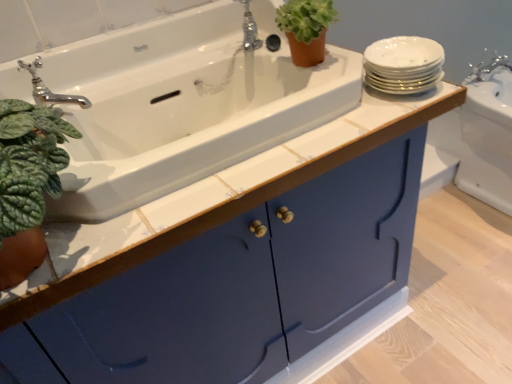
Question: Can you confirm if white glossy sink at upper right, the 2th sink from the front, is smaller than white porcelain plates at upper right?

Choices:
 (A) no
 (B) yes

Answer: (A)

Question: Would you consider white glossy sink at upper right, the first sink from the back, to be distant from white porcelain plates at upper right?

Choices:
 (A) yes
 (B) no

Answer: (B)

Question: Considering the relative positions of white glossy sink at upper right, which is the second sink from left to right, and white porcelain plates at upper right in the image provided, is white glossy sink at upper right, which is the second sink from left to right, to the left of white porcelain plates at upper right from the viewer's perspective?

Choices:
 (A) yes
 (B) no

Answer: (B)

Question: Is white glossy sink at upper right, the first sink from the back, positioned before white porcelain plates at upper right?

Choices:
 (A) yes
 (B) no

Answer: (B)

Question: Can we say white glossy sink at upper right, the 2th sink from the front, lies outside white porcelain plates at upper right?

Choices:
 (A) yes
 (B) no

Answer: (A)

Question: From the image's perspective, is white ceramic sink at upper left, the 2th sink from the back, above or below matte blue cabinet at center?

Choices:
 (A) below
 (B) above

Answer: (B)

Question: Is white ceramic sink at upper left, the 2th sink when ordered from right to left, in front of or behind matte blue cabinet at center in the image?

Choices:
 (A) behind
 (B) front

Answer: (A)

Question: Is white ceramic sink at upper left, which is the first sink from front to back, bigger or smaller than matte blue cabinet at center?

Choices:
 (A) big
 (B) small

Answer: (B)

Question: Considering the positions of white ceramic sink at upper left, which ranks as the first sink in left-to-right order, and matte blue cabinet at center in the image, is white ceramic sink at upper left, which ranks as the first sink in left-to-right order, taller or shorter than matte blue cabinet at center?

Choices:
 (A) short
 (B) tall

Answer: (A)

Question: Is matte blue cabinet at center to the left or to the right of white ceramic sink at upper left, which ranks as the first sink in left-to-right order, in the image?

Choices:
 (A) right
 (B) left

Answer: (B)

Question: Would you say matte blue cabinet at center is inside or outside white ceramic sink at upper left, the 2th sink when ordered from right to left?

Choices:
 (A) inside
 (B) outside

Answer: (B)

Question: In terms of size, does matte blue cabinet at center appear bigger or smaller than white ceramic sink at upper left, which is the first sink from front to back?

Choices:
 (A) big
 (B) small

Answer: (A)

Question: From a real-world perspective, is matte blue cabinet at center physically located above or below white ceramic sink at upper left, the 2th sink when ordered from right to left?

Choices:
 (A) above
 (B) below

Answer: (B)

Question: From their relative heights in the image, would you say chrome metallic faucet at upper left, the first tap in the front-to-back sequence, is taller or shorter than white porcelain plates at upper right?

Choices:
 (A) short
 (B) tall

Answer: (B)

Question: Do you think chrome metallic faucet at upper left, the 1th tap from the left, is within white porcelain plates at upper right, or outside of it?

Choices:
 (A) inside
 (B) outside

Answer: (B)